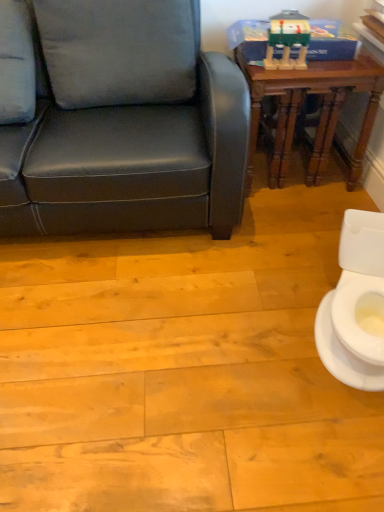
Locate an element on the screen. The image size is (384, 512). free space in front of wooden table at upper right is located at coordinates (284, 224).